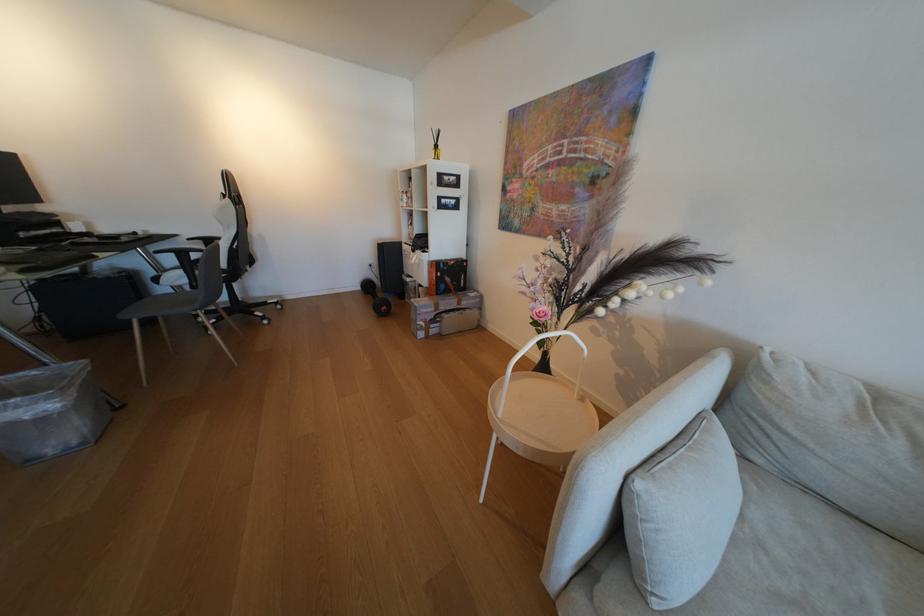
Identify the location of sofa sitting surface. Image resolution: width=924 pixels, height=616 pixels. (812, 557).